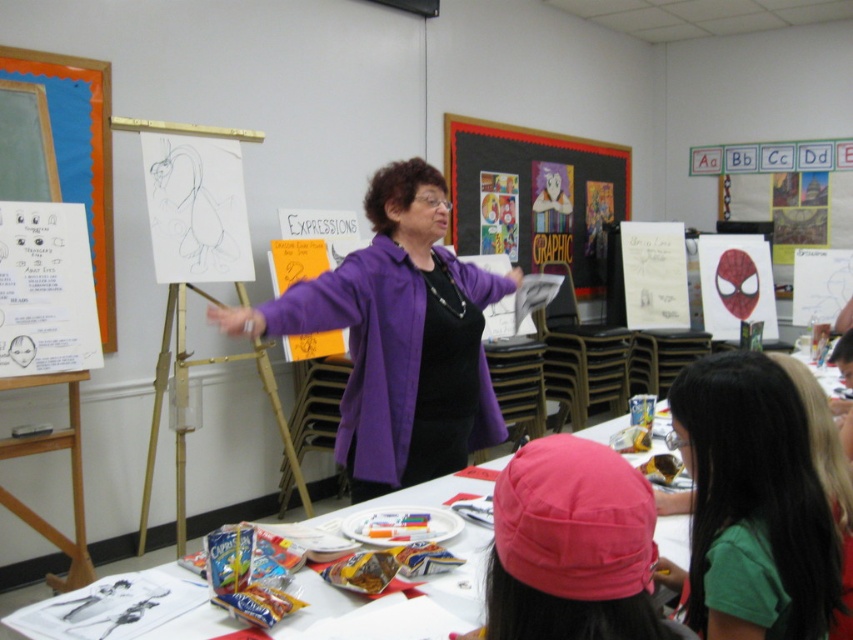
You are a student sitting in the classroom and want to see the matte black bulletin board at center clearly. The teacher says you can move closer, but the closest you can get is 4 meters. Will you be able to see it clearly from there?

The matte black bulletin board at center is 4.69 meters away from viewer. Since you can only move to 4 meters, you will be closer than the original distance, so you will be able to see it clearly.

You are a student in the classroom and need to hand in an assignment. The teacher has asked you to place it on the white paper at center. However, there is also a matte black bulletin board at center nearby. Which object should you approach to submit your assignment?

You should approach the white paper at center to submit your assignment because the teacher specifically asked to place it there, and it is located to the left of the matte black bulletin board at center.

You are a student in the classroom and need to hang a small poster. You have two options for placement on the white paper at center and the matte black bulletin board at center. Which surface can accommodate a poster that is 1 meter wide?

The matte black bulletin board at center can accommodate the poster since the white paper at center has a lesser width compared to it.